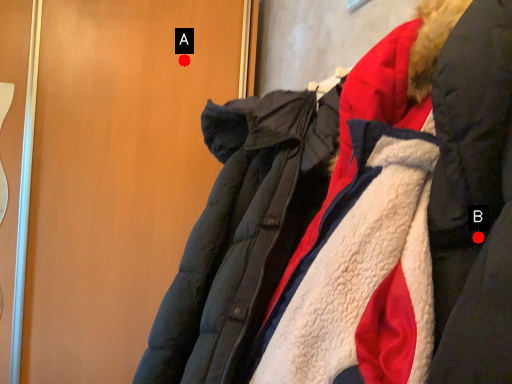
Question: Two points are circled on the image, labeled by A and B beside each circle. Which point is further to the camera?

Choices:
 (A) A is further
 (B) B is further

Answer: (A)